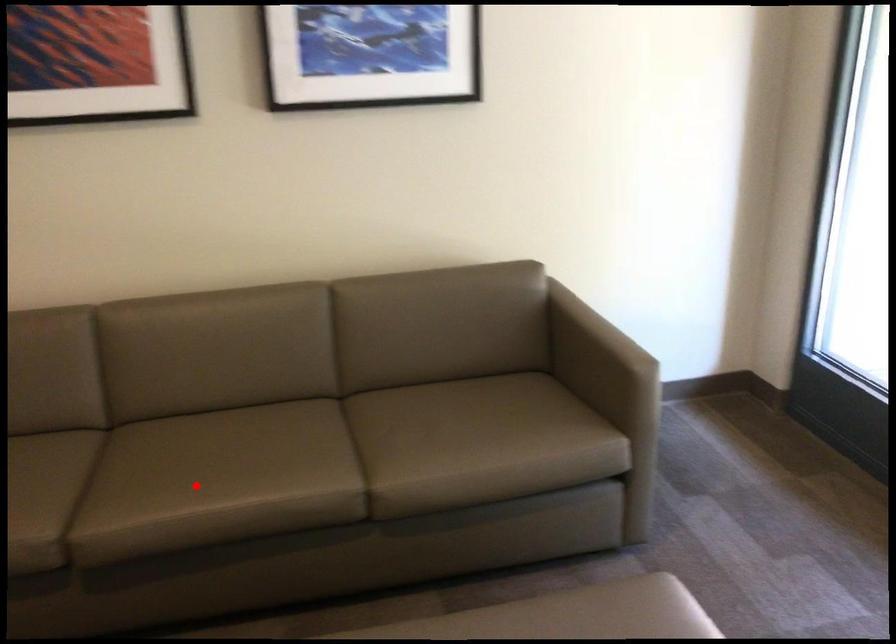
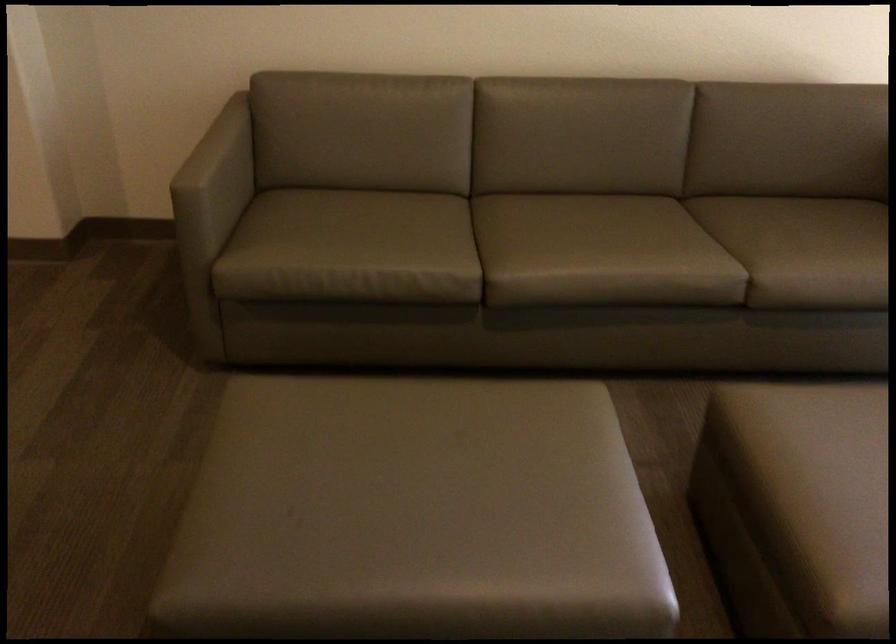
Question: I am providing you with two images of the same scene from different viewpoints. In image1, a red point is highlighted. Considering the same 3D point in image2, which of the following is correct?

Choices:
 (A) It is closer
 (B) It is farther

Answer: (B)